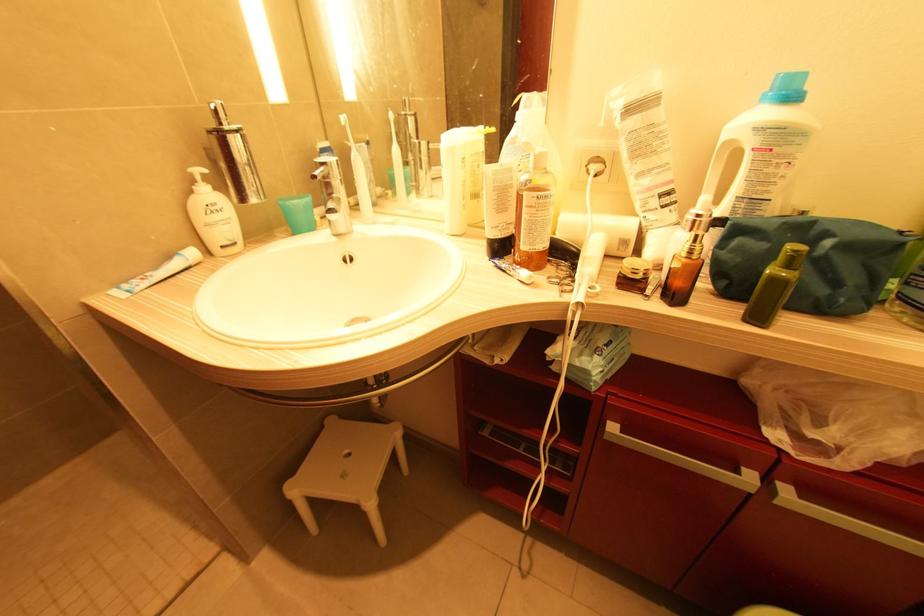
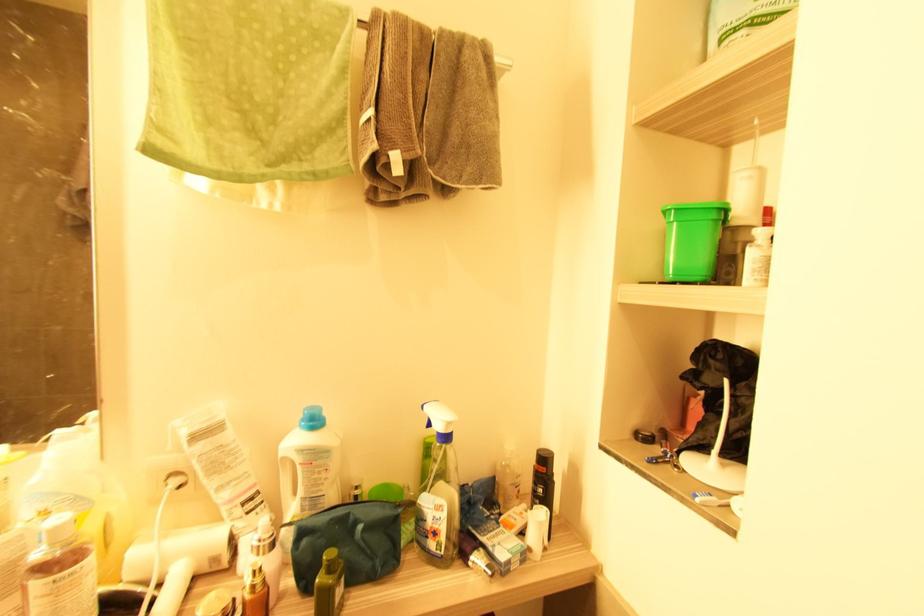
Where in the second image is the point corresponding to point (789, 267) from the first image?

(331, 572)